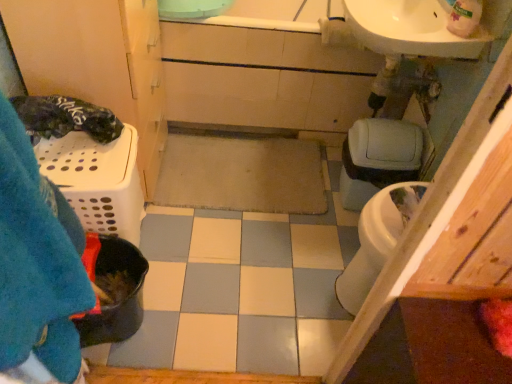
Question: Is blue fuzzy blanket at left inside white glossy sink at upper right?

Choices:
 (A) no
 (B) yes

Answer: (A)

Question: Does white glossy sink at upper right have a greater height compared to blue fuzzy blanket at left?

Choices:
 (A) yes
 (B) no

Answer: (B)

Question: Considering the relative sizes of white glossy sink at upper right and blue fuzzy blanket at left in the image provided, is white glossy sink at upper right bigger than blue fuzzy blanket at left?

Choices:
 (A) no
 (B) yes

Answer: (B)

Question: Is white glossy sink at upper right to the left of blue fuzzy blanket at left from the viewer's perspective?

Choices:
 (A) no
 (B) yes

Answer: (A)

Question: Considering the relative sizes of white glossy sink at upper right and blue fuzzy blanket at left in the image provided, is white glossy sink at upper right wider than blue fuzzy blanket at left?

Choices:
 (A) yes
 (B) no

Answer: (A)

Question: Considering the positions of point 399,175 and point 74,3, is point 399,175 closer or farther from the camera than point 74,3?

Choices:
 (A) closer
 (B) farther

Answer: (B)

Question: Choose the correct answer: Is matte gray toilet bowl at right inside white plastic laundry basket at left or outside it?

Choices:
 (A) outside
 (B) inside

Answer: (A)

Question: Considering the relative positions of matte gray toilet bowl at right and white plastic laundry basket at left in the image provided, is matte gray toilet bowl at right to the left or to the right of white plastic laundry basket at left?

Choices:
 (A) right
 (B) left

Answer: (A)

Question: Is matte gray toilet bowl at right in front of or behind white plastic laundry basket at left in the image?

Choices:
 (A) behind
 (B) front

Answer: (A)

Question: From a real-world perspective, is matte gray toilet bowl at right positioned above or below blue fuzzy blanket at left?

Choices:
 (A) above
 (B) below

Answer: (B)

Question: In terms of height, does matte gray toilet bowl at right look taller or shorter compared to blue fuzzy blanket at left?

Choices:
 (A) tall
 (B) short

Answer: (B)

Question: Based on their positions, is matte gray toilet bowl at right located to the left or right of blue fuzzy blanket at left?

Choices:
 (A) right
 (B) left

Answer: (A)

Question: Is matte gray toilet bowl at right in front of or behind blue fuzzy blanket at left in the image?

Choices:
 (A) behind
 (B) front

Answer: (A)

Question: Considering the positions of point (78, 370) and point (473, 56), is point (78, 370) closer or farther from the camera than point (473, 56)?

Choices:
 (A) farther
 (B) closer

Answer: (B)

Question: Is blue fuzzy blanket at left in front of or behind white glossy sink at upper right in the image?

Choices:
 (A) front
 (B) behind

Answer: (A)